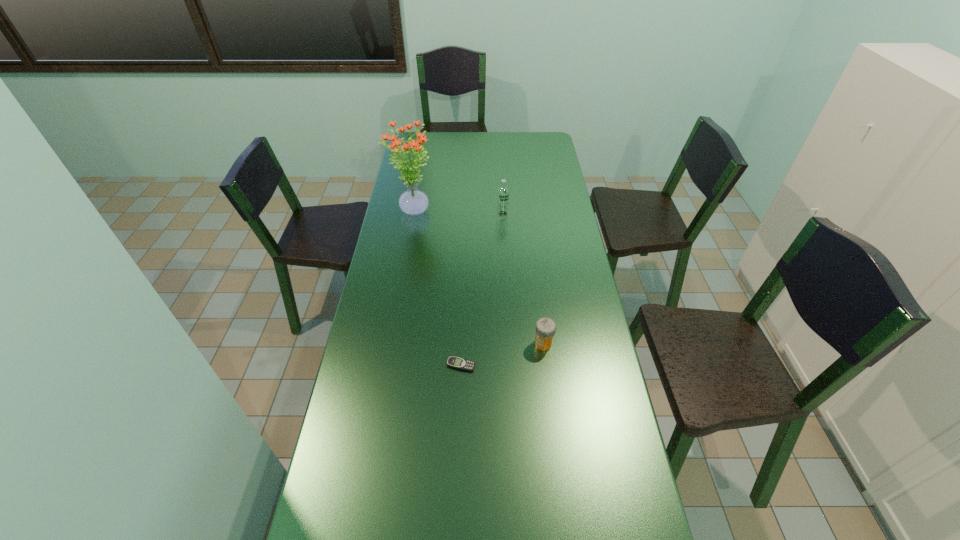
Identify the location of vacant region between the beeper and the third tallest object. Image resolution: width=960 pixels, height=540 pixels. (502, 354).

The image size is (960, 540). Identify the location of empty space that is in between the shortest object and the rightmost object. (502, 354).

Locate an element on the screen. vacant space that is in between the second object from left to right and the third farthest object is located at coordinates (502, 354).

Find the location of `vacant space in between the second object from right to left and the tallest object`. vacant space in between the second object from right to left and the tallest object is located at coordinates point(458,213).

Locate an element on the screen. Image resolution: width=960 pixels, height=540 pixels. free spot between the second tallest object and the tallest object is located at coordinates (458, 213).

I want to click on unoccupied area between the nearest object and the second nearest object, so click(x=502, y=354).

Locate an element on the screen. This screenshot has width=960, height=540. empty location between the second tallest object and the second nearest object is located at coordinates (523, 279).

Image resolution: width=960 pixels, height=540 pixels. What are the coordinates of `vacant space in between the flower arrangement and the beeper` in the screenshot? It's located at (437, 288).

At what (x,y) coordinates should I click in order to perform the action: click on free space between the second nearest object and the flower arrangement. Please return your answer as a coordinate pair (x, y). The height and width of the screenshot is (540, 960). Looking at the image, I should click on (478, 278).

Identify which object is located as the second nearest to the third object from left to right. Please provide its 2D coordinates. Your answer should be formatted as a tuple, i.e. [(x, y)], where the tuple contains the x and y coordinates of a point satisfying the conditions above.

[(545, 328)]